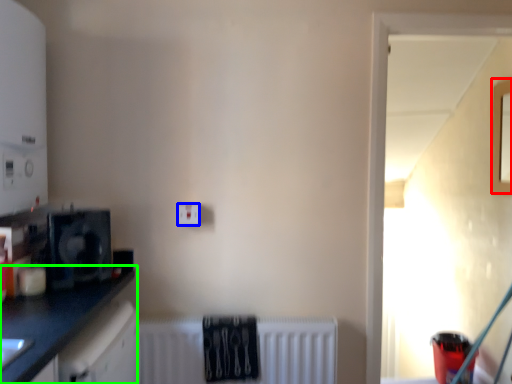
Question: Based on their relative distances, which object is nearer to window (highlighted by a red box)? Choose from electric outlet (highlighted by a blue box) and countertop (highlighted by a green box).

Choices:
 (A) electric outlet
 (B) countertop

Answer: (A)